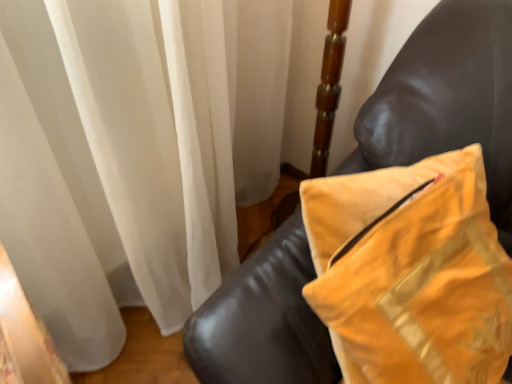
This screenshot has height=384, width=512. Describe the element at coordinates (412, 274) in the screenshot. I see `yellow velvet pillow at upper right` at that location.

The height and width of the screenshot is (384, 512). I want to click on yellow velvet pillow at upper right, so click(x=412, y=274).

Image resolution: width=512 pixels, height=384 pixels. What do you see at coordinates (447, 99) in the screenshot? I see `leather couch at right` at bounding box center [447, 99].

Locate an element on the screen. The width and height of the screenshot is (512, 384). leather couch at right is located at coordinates (447, 99).

What is the approximate width of leather couch at right?

The width of leather couch at right is 52.69 centimeters.

Locate an element on the screen. yellow velvet pillow at upper right is located at coordinates (412, 274).

Can you confirm if yellow velvet pillow at upper right is positioned to the left of leather couch at right?

In fact, yellow velvet pillow at upper right is to the right of leather couch at right.

From the picture: Is yellow velvet pillow at upper right further to the viewer compared to leather couch at right?

No, yellow velvet pillow at upper right is in front of leather couch at right.

Does point (392, 233) lie behind point (414, 106)?

No, it is in front of (414, 106).

From the image's perspective, is yellow velvet pillow at upper right on top of leather couch at right?

No, from the image's perspective, yellow velvet pillow at upper right is not on top of leather couch at right.

From a real-world perspective, which is physically above, yellow velvet pillow at upper right or leather couch at right?

In real-world perspective, yellow velvet pillow at upper right is above.

Between yellow velvet pillow at upper right and leather couch at right, which one has smaller width?

With smaller width is yellow velvet pillow at upper right.

In the scene shown: Which of these two, yellow velvet pillow at upper right or leather couch at right, stands shorter?

With less height is yellow velvet pillow at upper right.

Does yellow velvet pillow at upper right have a larger size compared to leather couch at right?

Incorrect, yellow velvet pillow at upper right is not larger than leather couch at right.

Do you think yellow velvet pillow at upper right is within leather couch at right, or outside of it?

yellow velvet pillow at upper right is not inside leather couch at right, it's outside.

Does yellow velvet pillow at upper right touch leather couch at right?

No, yellow velvet pillow at upper right is not making contact with leather couch at right.

Based on the photo, is yellow velvet pillow at upper right looking in the opposite direction of leather couch at right?

Yes, yellow velvet pillow at upper right's orientation is away from leather couch at right.

Locate an element on the screen. The height and width of the screenshot is (384, 512). pillow in front of the leather couch at right is located at coordinates 412,274.

Considering the positions of objects leather couch at right and yellow velvet pillow at upper right in the image provided, who is more to the left, leather couch at right or yellow velvet pillow at upper right?

From the viewer's perspective, leather couch at right appears more on the left side.

Considering their positions, is leather couch at right located in front of or behind yellow velvet pillow at upper right?

leather couch at right is behind yellow velvet pillow at upper right.

Is point (406, 150) behind point (367, 367)?

Yes.

From the image's perspective, which one is positioned higher, leather couch at right or yellow velvet pillow at upper right?

leather couch at right is shown above in the image.

From a real-world perspective, which is physically above, leather couch at right or yellow velvet pillow at upper right?

yellow velvet pillow at upper right, from a real-world perspective.

Does leather couch at right have a lesser width compared to yellow velvet pillow at upper right?

No, leather couch at right is not thinner than yellow velvet pillow at upper right.

From their relative heights in the image, would you say leather couch at right is taller or shorter than yellow velvet pillow at upper right?

In the image, leather couch at right appears to be taller than yellow velvet pillow at upper right.

In the scene shown: Is leather couch at right bigger than yellow velvet pillow at upper right?

Yes.

Would you say leather couch at right contains yellow velvet pillow at upper right?

No.

Is leather couch at right not close to yellow velvet pillow at upper right?

They are positioned close to each other.

Is leather couch at right aimed at yellow velvet pillow at upper right?

No, leather couch at right is not turned towards yellow velvet pillow at upper right.

Measure the distance from leather couch at right to yellow velvet pillow at upper right.

They are 5.02 inches apart.

Identify the location of pillow to the right of leather couch at right. This screenshot has width=512, height=384. (412, 274).

The width and height of the screenshot is (512, 384). In the image, there is a yellow velvet pillow at upper right. Find the location of `furniture below it (from a real-world perspective)`. furniture below it (from a real-world perspective) is located at coordinates (x=447, y=99).

Where is `pillow on the right of leather couch at right`? pillow on the right of leather couch at right is located at coordinates (412, 274).